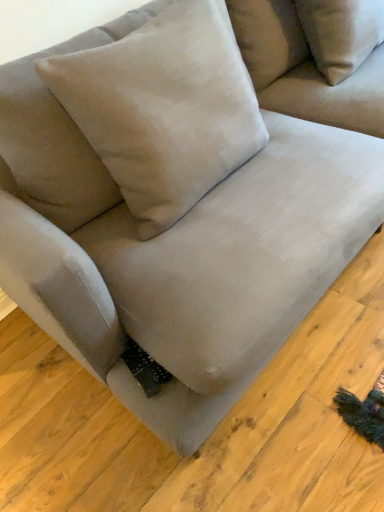
Question: Can you confirm if suede-like beige couch at upper right is shorter than velvet beige pillow at center?

Choices:
 (A) no
 (B) yes

Answer: (B)

Question: Considering the relative positions of suede-like beige couch at upper right and velvet beige pillow at center in the image provided, is suede-like beige couch at upper right to the left of velvet beige pillow at center from the viewer's perspective?

Choices:
 (A) yes
 (B) no

Answer: (B)

Question: Is velvet beige pillow at center a part of suede-like beige couch at upper right?

Choices:
 (A) no
 (B) yes

Answer: (A)

Question: Is suede-like beige couch at upper right located outside velvet beige pillow at center?

Choices:
 (A) no
 (B) yes

Answer: (B)

Question: From a real-world perspective, is suede-like beige couch at upper right physically above velvet beige pillow at center?

Choices:
 (A) yes
 (B) no

Answer: (B)

Question: Can you confirm if suede-like beige couch at upper right is bigger than velvet beige pillow at center?

Choices:
 (A) yes
 (B) no

Answer: (B)

Question: Is velvet beige pillow at center closer to the viewer compared to suede-like beige couch at upper right?

Choices:
 (A) yes
 (B) no

Answer: (A)

Question: From the image's perspective, would you say velvet beige pillow at center is shown under suede-like beige couch at upper right?

Choices:
 (A) yes
 (B) no

Answer: (A)

Question: From a real-world perspective, is velvet beige pillow at center physically above suede-like beige couch at upper right?

Choices:
 (A) no
 (B) yes

Answer: (B)

Question: Considering the relative sizes of velvet beige pillow at center and suede-like beige couch at upper right in the image provided, is velvet beige pillow at center thinner than suede-like beige couch at upper right?

Choices:
 (A) yes
 (B) no

Answer: (A)

Question: Is there a large distance between velvet beige pillow at center and suede-like beige couch at upper right?

Choices:
 (A) yes
 (B) no

Answer: (B)

Question: Is velvet beige pillow at center behind suede-like beige couch at upper right?

Choices:
 (A) no
 (B) yes

Answer: (A)

Question: Does point (180, 132) appear closer or farther from the camera than point (327, 61)?

Choices:
 (A) farther
 (B) closer

Answer: (B)